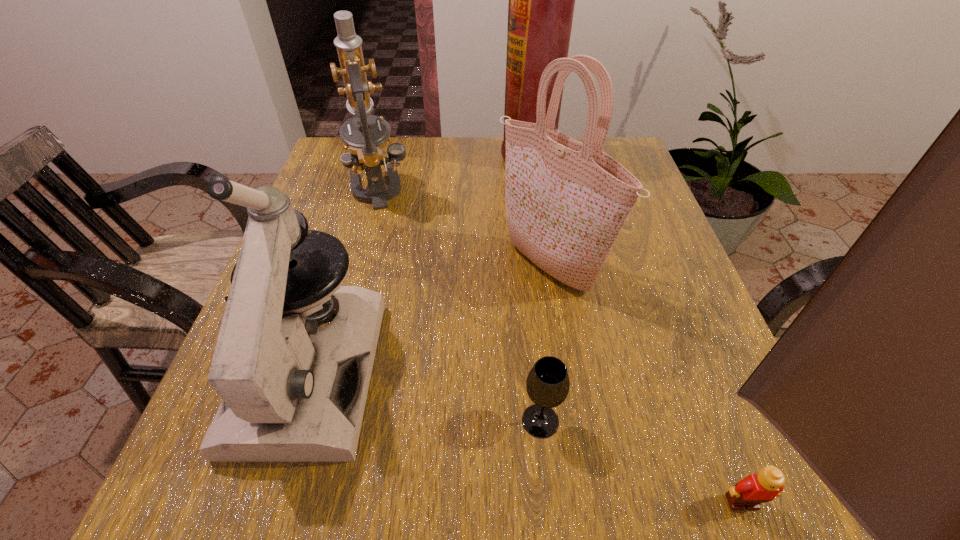
Find the location of `object located at the near left corner`. object located at the near left corner is located at coordinates (291, 392).

What are the coordinates of `object that is at the near right corner` in the screenshot? It's located at (750, 492).

Locate an element on the screen. The height and width of the screenshot is (540, 960). vacant space at the far edge of the desktop is located at coordinates (493, 173).

This screenshot has height=540, width=960. Find the location of `free space at the near edge of the desktop`. free space at the near edge of the desktop is located at coordinates (574, 494).

Identify the location of vacant region at the left edge of the desktop. (329, 214).

You are a GUI agent. You are given a task and a screenshot of the screen. Output one action in this format:
    pyautogui.click(x=<x>, y=<y>)
    Task: Click on the free space at the right edge
    The width and height of the screenshot is (960, 540).
    Given the screenshot: What is the action you would take?
    pyautogui.click(x=674, y=353)

The height and width of the screenshot is (540, 960). What are the coordinates of `blank space at the far right corner of the desktop` in the screenshot? It's located at (619, 145).

Identify the location of vacant space that's between the shortest object and the farther microscope. (560, 346).

Where is `free spot between the farther microscope and the shopping bag`? This screenshot has width=960, height=540. free spot between the farther microscope and the shopping bag is located at coordinates (x=464, y=228).

Identify the location of free space between the second shortest object and the farther microscope. The width and height of the screenshot is (960, 540). (459, 305).